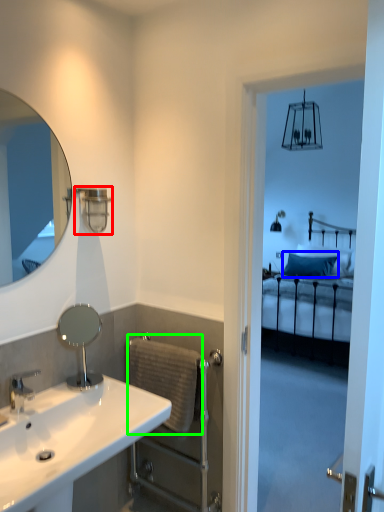
Question: Estimate the real-world distances between objects in this image. Which object is farther from shower (highlighted by a red box), pillow (highlighted by a blue box) or towel bar (highlighted by a green box)?

Choices:
 (A) pillow
 (B) towel bar

Answer: (A)